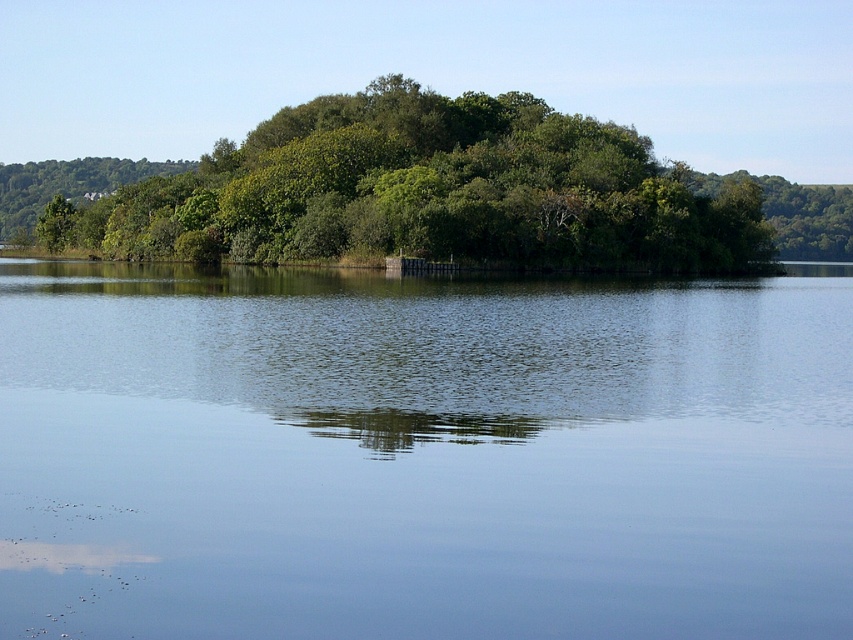
Question: Does transparent water at center appear on the left side of green leafy trees at center?

Choices:
 (A) yes
 (B) no

Answer: (B)

Question: Does transparent water at center have a larger size compared to green leafy trees at center?

Choices:
 (A) no
 (B) yes

Answer: (A)

Question: Which of the following is the closest to the observer?

Choices:
 (A) transparent water at center
 (B) green leafy trees at center

Answer: (A)

Question: Which of the following is the farthest from the observer?

Choices:
 (A) (703, 429)
 (B) (651, 243)

Answer: (B)

Question: Does transparent water at center lie in front of green leafy trees at center?

Choices:
 (A) no
 (B) yes

Answer: (B)